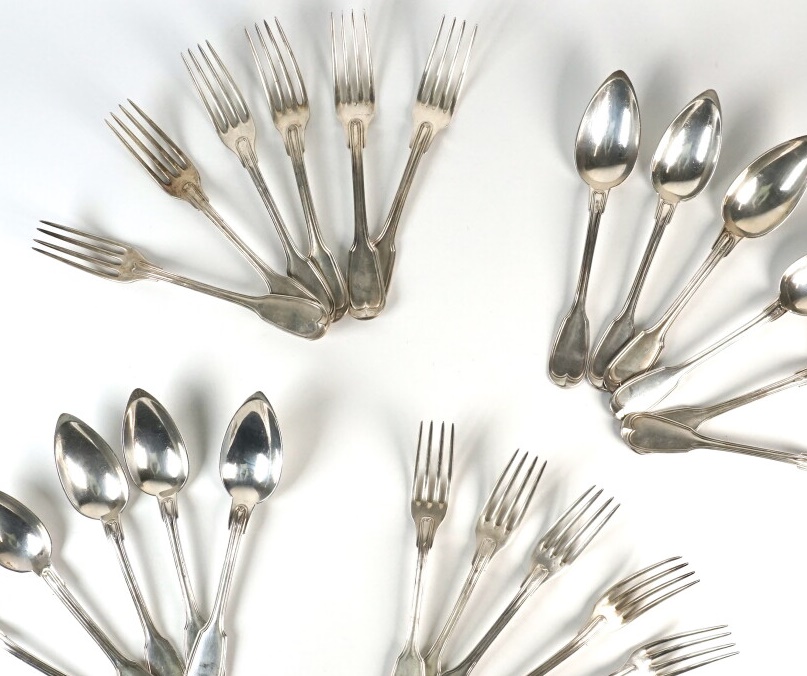
Identify the location of forks on the left side of the image. The height and width of the screenshot is (676, 807). (103, 264), (184, 172), (245, 120), (298, 110), (349, 105).